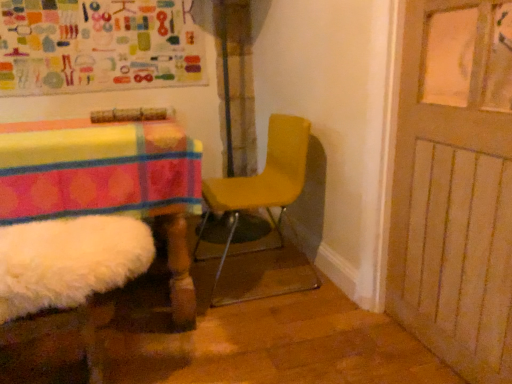
Identify the location of free space to the left of wooden door at right. The image size is (512, 384). (344, 361).